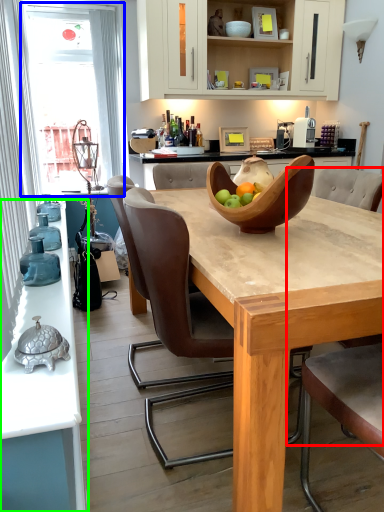
Question: Which is nearer to the armchair (highlighted by a red box)? window screen (highlighted by a blue box) or countertop (highlighted by a green box).

Choices:
 (A) window screen
 (B) countertop

Answer: (B)